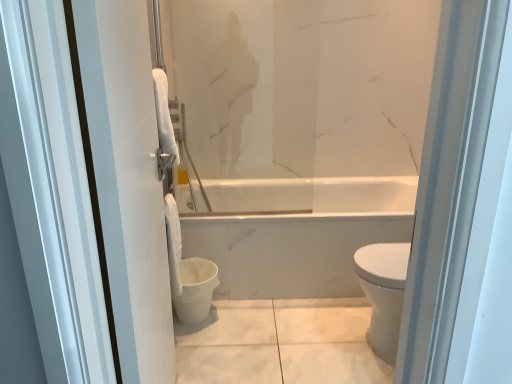
The width and height of the screenshot is (512, 384). Describe the element at coordinates (173, 243) in the screenshot. I see `white fabric towel at lower center` at that location.

Locate an element on the screen. The height and width of the screenshot is (384, 512). white glossy towel at left is located at coordinates (132, 192).

From the image's perspective, is white matte toilet bowl at lower center above or below white glossy towel at left?

From the image's perspective, white matte toilet bowl at lower center appears below white glossy towel at left.

Can you see white matte toilet bowl at lower center touching white glossy towel at left?

white matte toilet bowl at lower center is not next to white glossy towel at left, and they're not touching.

From a real-world perspective, between white matte toilet bowl at lower center and white glossy towel at left, who is vertically lower?

white matte toilet bowl at lower center is physically lower.

Is white matte toilet bowl at lower center smaller than white glossy towel at left?

Indeed, white matte toilet bowl at lower center has a smaller size compared to white glossy towel at left.

Is white glossy towel at left beside white matte toilet bowl at lower center?

They are not placed beside each other.

Does white glossy towel at left have a lesser height compared to white matte toilet bowl at lower center?

Incorrect, the height of white glossy towel at left does not fall short of that of white matte toilet bowl at lower center.

Which object is closer to the camera, white glossy towel at left or white matte toilet bowl at lower center?

white glossy towel at left.

Which is correct: white matte toilet bowl at lower center is inside white fabric towel at lower center, or outside of it?

white matte toilet bowl at lower center is not inside white fabric towel at lower center, it's outside.

Locate an element on the screen. Image resolution: width=512 pixels, height=384 pixels. toilet paper to the left of white matte toilet bowl at lower center is located at coordinates (173, 243).

From a real-world perspective, is white matte toilet bowl at lower center located higher than white fabric towel at lower center?

No, from a real-world perspective, white matte toilet bowl at lower center is not above white fabric towel at lower center.

Looking at the image, does white matte toilet bowl at lower center seem bigger or smaller compared to white fabric towel at lower center?

In the image, white matte toilet bowl at lower center appears to be larger than white fabric towel at lower center.

What's the angular difference between white glossy towel at left and white fabric towel at lower center's facing directions?

white glossy towel at left and white fabric towel at lower center are facing 1.23 degrees away from each other.

Locate an element on the screen. The height and width of the screenshot is (384, 512). screen door positioned vertically above the white fabric towel at lower center (from a real-world perspective) is located at coordinates (132, 192).

Is point (163, 304) closer to viewer compared to point (181, 291)?

Yes, point (163, 304) is closer to viewer.

From a real-world perspective, is white glossy towel at left positioned above or below white fabric towel at lower center?

Clearly, from a real-world perspective, white glossy towel at left is above white fabric towel at lower center.

Looking at their sizes, would you say white fabric towel at lower center is wider or thinner than white glossy towel at left?

Considering their sizes, white fabric towel at lower center looks slimmer than white glossy towel at left.

The height and width of the screenshot is (384, 512). I want to click on screen door lying on the right of white fabric towel at lower center, so click(132, 192).

Can you confirm if white fabric towel at lower center is shorter than white glossy towel at left?

Yes.

Which is behind, point (170, 270) or point (154, 127)?

Positioned behind is point (170, 270).

How far apart are white fabric towel at lower center and white matte toilet bowl at lower center?

The distance of white fabric towel at lower center from white matte toilet bowl at lower center is 4.90 inches.

Could you tell me if white fabric towel at lower center is facing white matte toilet bowl at lower center?

No.

Is white fabric towel at lower center wider than white matte toilet bowl at lower center?

No, white fabric towel at lower center is not wider than white matte toilet bowl at lower center.

Based on their sizes in the image, would you say white fabric towel at lower center is bigger or smaller than white matte toilet bowl at lower center?

In the image, white fabric towel at lower center appears to be smaller than white matte toilet bowl at lower center.

The image size is (512, 384). There is a white matte toilet bowl at lower center. Find the location of `screen door above it (from a real-world perspective)`. screen door above it (from a real-world perspective) is located at coordinates (132, 192).

Find the location of a particular element. toilet bowl on the right of white glossy towel at left is located at coordinates (195, 289).

Which object lies further to the anchor point white glossy towel at left, white fabric towel at lower center or white matte toilet bowl at lower center?

white matte toilet bowl at lower center lies further to white glossy towel at left than the other object.

Looking at the image, which one is located closer to white glossy towel at left, white matte toilet bowl at lower center or white fabric towel at lower center?

The object closer to white glossy towel at left is white fabric towel at lower center.

Which object lies nearer to the anchor point white fabric towel at lower center, white glossy towel at left or white matte toilet bowl at lower center?

Based on the image, white matte toilet bowl at lower center appears to be nearer to white fabric towel at lower center.

Based on their spatial positions, is white fabric towel at lower center or white glossy towel at left further from white matte toilet bowl at lower center?

Among the two, white glossy towel at left is located further to white matte toilet bowl at lower center.

When comparing their distances from white matte toilet bowl at lower center, does white glossy towel at left or white fabric towel at lower center seem further?

Based on the image, white glossy towel at left appears to be further to white matte toilet bowl at lower center.

Which object lies nearer to the anchor point white fabric towel at lower center, white matte toilet bowl at lower center or white glossy towel at left?

white matte toilet bowl at lower center lies closer to white fabric towel at lower center than the other object.

Where is `toilet paper between white glossy towel at left and white matte toilet bowl at lower center along the z-axis`? The image size is (512, 384). toilet paper between white glossy towel at left and white matte toilet bowl at lower center along the z-axis is located at coordinates (173, 243).